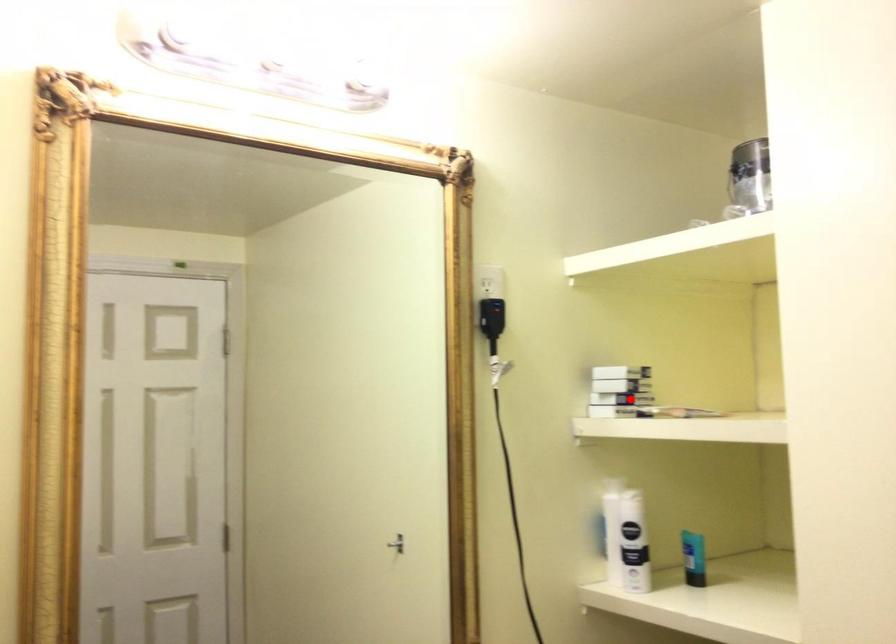
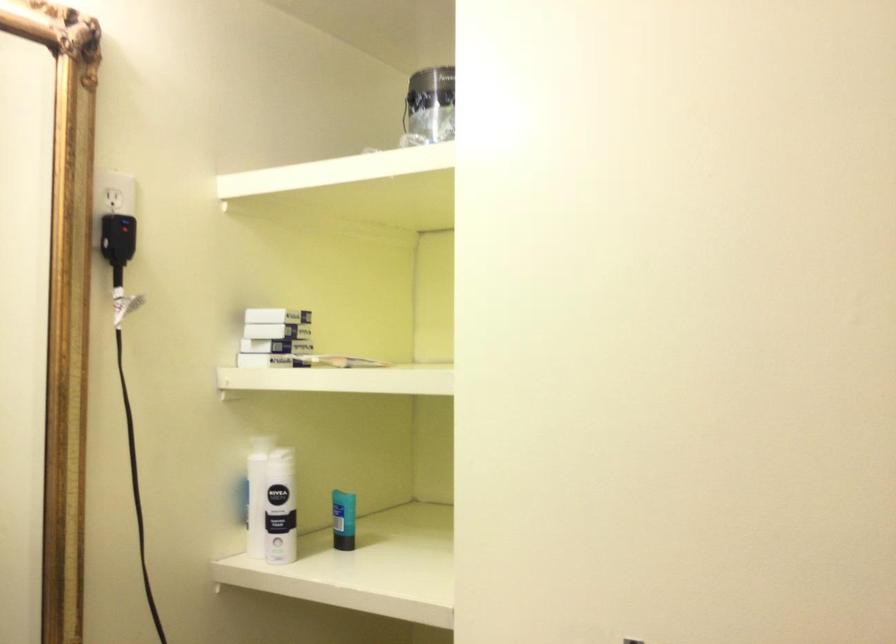
Find the pixel in the second image that matches the highlighted location in the first image.

(273, 346)